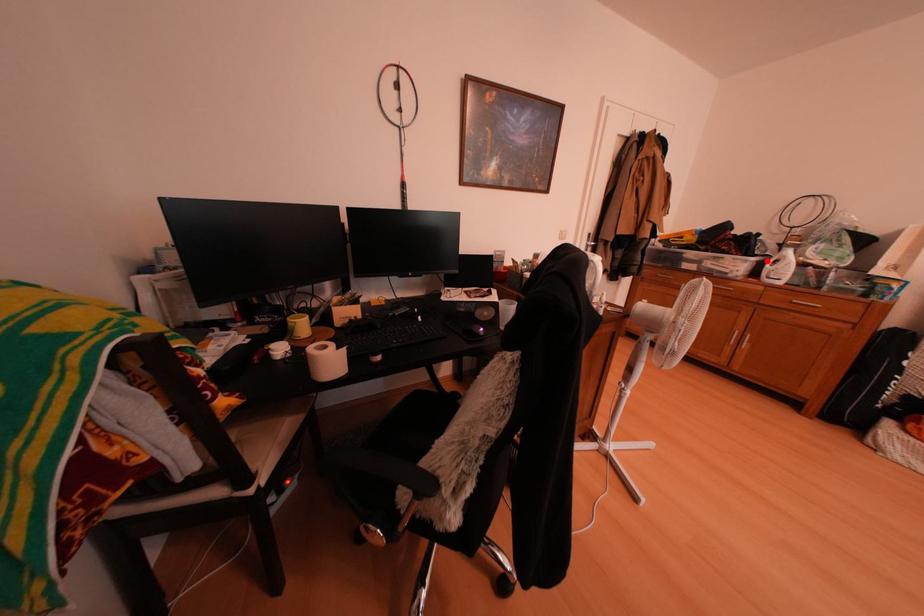
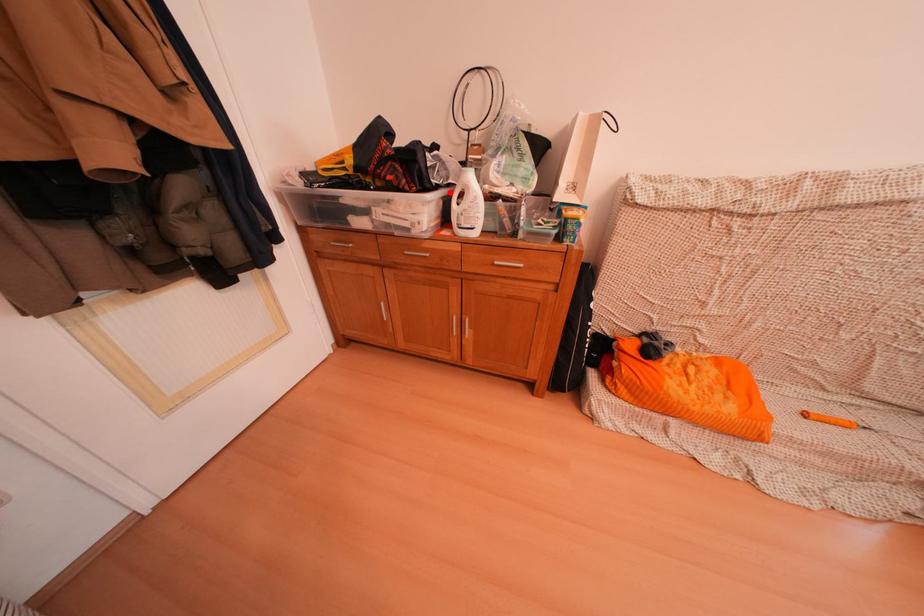
I am providing you with two images of the same scene from different viewpoints. A red point is marked on the first image and another point is marked on the second image. Does the point marked in image1 correspond to the same location as the one in image2?

Yes